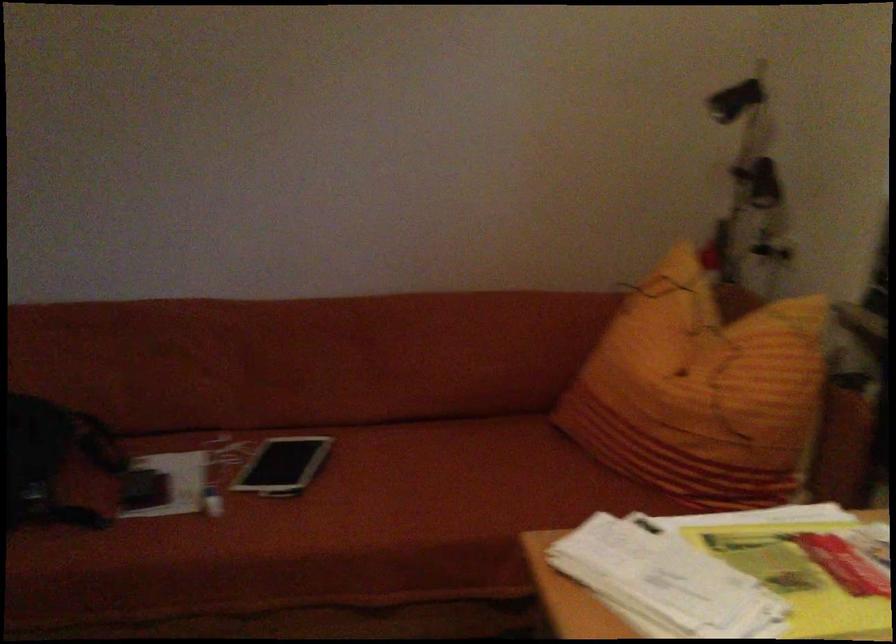
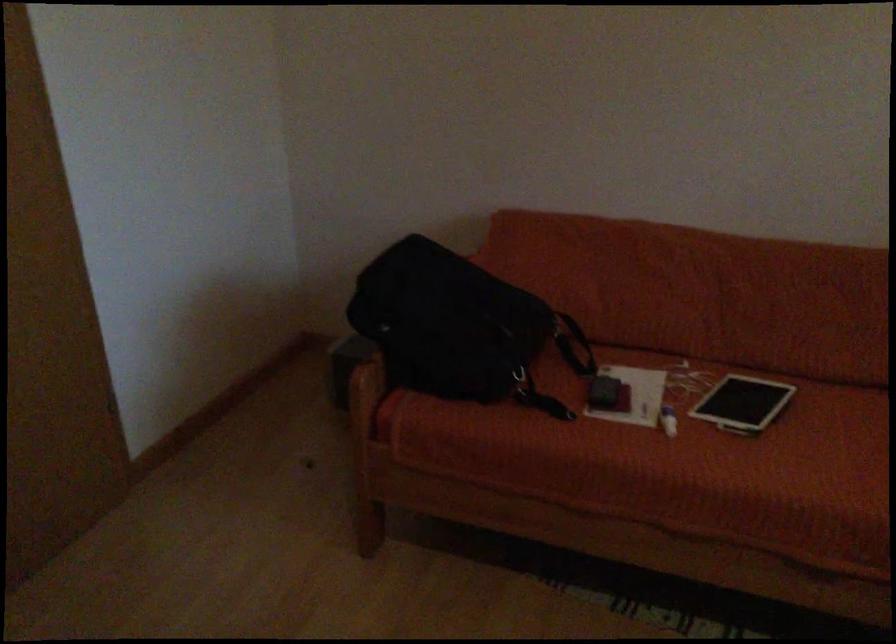
In a continuous first-person perspective shot, in which direction is the camera moving?

The movement direction of the cameraman is left, backward.